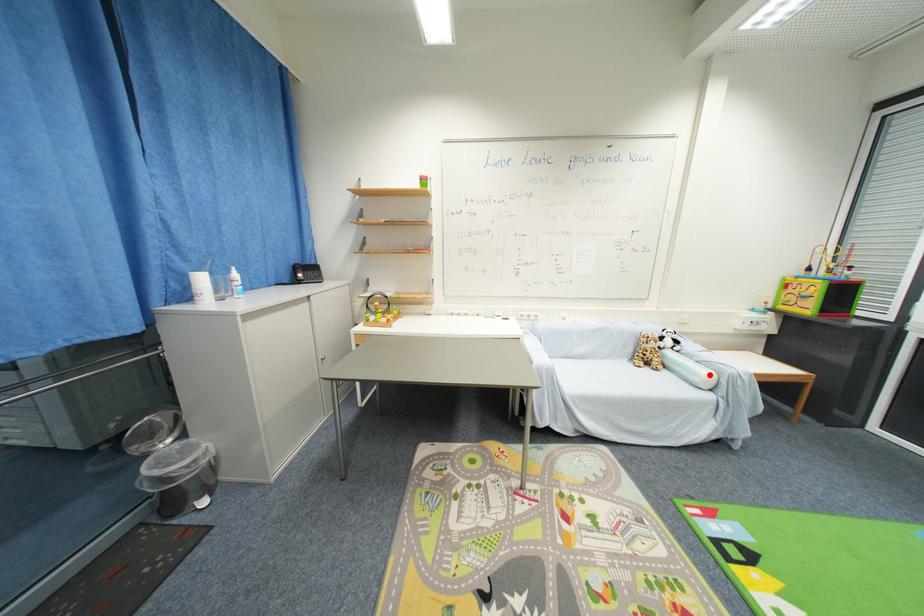
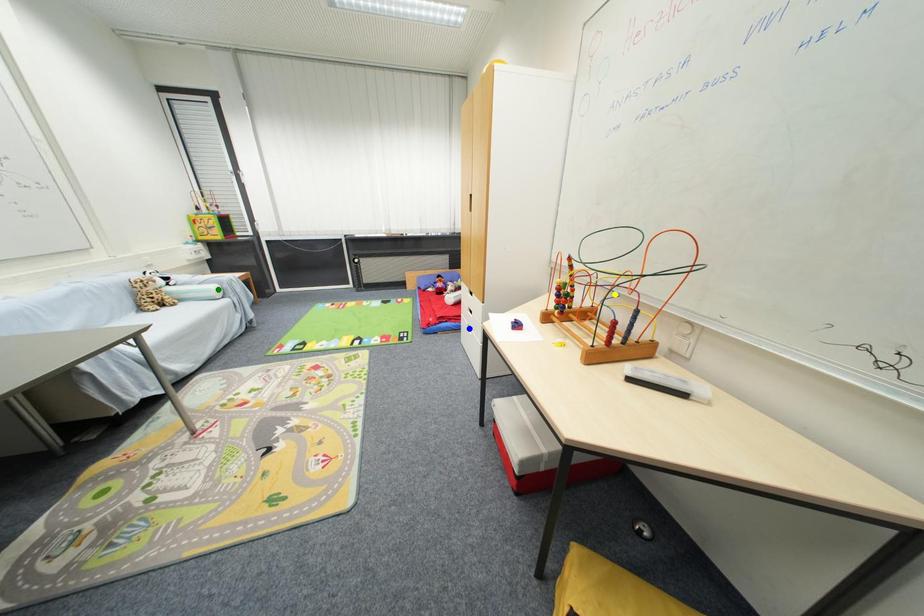
Question: I am providing you with two images of the same scene from different viewpoints. A red point is marked on the first image. You are given multiple points on the second image. In image 2, which mark is for the same physical point as the one in image 1?

Choices:
 (A) blue point
 (B) green point
 (C) yellow point

Answer: (B)